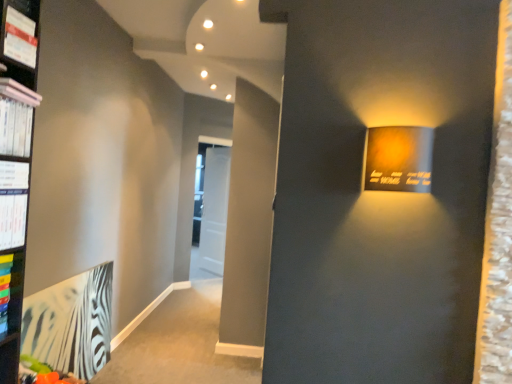
Question: From the image's perspective, is matte white magazine at upper left, placed as the 1th magazine when sorted from top to bottom, positioned above or below pink matte book at upper left?

Choices:
 (A) below
 (B) above

Answer: (B)

Question: Is matte white magazine at upper left, positioned as the second magazine in bottom-to-top order, in front of or behind pink matte book at upper left in the image?

Choices:
 (A) behind
 (B) front

Answer: (A)

Question: Estimate the real-world distances between objects in this image. Which object is farther from the zebra-patterned paper at lower left, the 2th paperback book in the top-to-bottom sequence?

Choices:
 (A) white paper at left, the second paperback book in the bottom-to-top sequence
 (B) matte white magazine at upper left, positioned as the second magazine in bottom-to-top order
 (C) white glossy magazine at left, acting as the 1th magazine starting from the bottom
 (D) pink matte book at upper left

Answer: (B)

Question: Which object is positioned farthest from the white glossy magazine at left, acting as the 1th magazine starting from the bottom?

Choices:
 (A) matte white magazine at upper left, placed as the 1th magazine when sorted from top to bottom
 (B) zebra-patterned paper at lower left, acting as the first paperback book starting from the left
 (C) pink matte book at upper left
 (D) white paper at left, the first paperback book in the top-to-bottom sequence

Answer: (B)